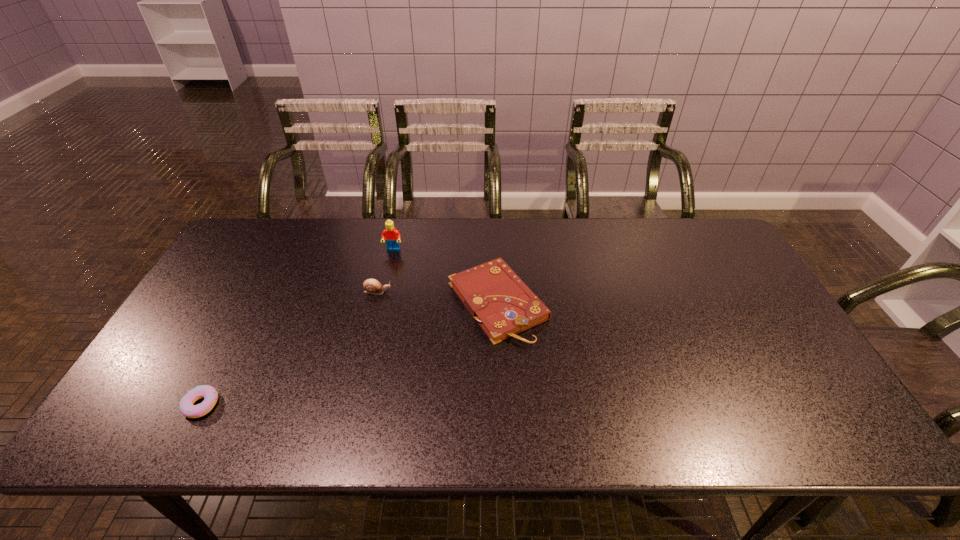
Find the location of a particular element. object present at the far edge is located at coordinates (392, 236).

The width and height of the screenshot is (960, 540). Identify the location of object positioned at the near edge. (209, 393).

I want to click on object that is at the left edge, so click(x=209, y=393).

Locate an element on the screen. object that is at the near left corner is located at coordinates (209, 393).

In the image, there is a desktop. Identify the location of vacant space at the far edge. (545, 217).

Locate an element on the screen. The height and width of the screenshot is (540, 960). vacant space at the near edge of the desktop is located at coordinates (631, 409).

Identify the location of free spot at the left edge of the desktop. Image resolution: width=960 pixels, height=540 pixels. (247, 270).

Image resolution: width=960 pixels, height=540 pixels. In order to click on vacant space at the right edge of the desktop in this screenshot , I will do `click(702, 272)`.

You are a GUI agent. You are given a task and a screenshot of the screen. Output one action in this format:
    pyautogui.click(x=<x>, y=<y>)
    Task: Click on the vacant space at the near left corner of the desktop
    Image resolution: width=960 pixels, height=540 pixels.
    Given the screenshot: What is the action you would take?
    pyautogui.click(x=154, y=437)

Locate an element on the screen. unoccupied position between the notebook and the shortest object is located at coordinates (349, 353).